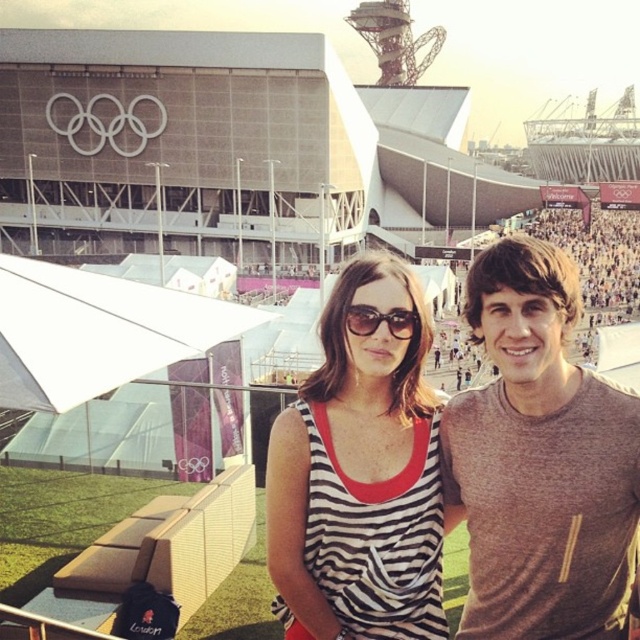
Between striped fabric tank top at center and sunglasses at center, which one appears on the left side from the viewer's perspective?

striped fabric tank top at center

Can you confirm if striped fabric tank top at center is wider than sunglasses at center?

Yes.

Which is behind, point (378, 412) or point (356, 310)?

The point (378, 412) is behind.

This screenshot has height=640, width=640. In order to click on striped fabric tank top at center in this screenshot , I will do `click(358, 476)`.

Who is shorter, gray cotton t-shirt at center or sunglasses at center?

Standing shorter between the two is sunglasses at center.

Who is lower down, gray cotton t-shirt at center or sunglasses at center?

gray cotton t-shirt at center is lower down.

Does point (500, 435) come farther from viewer compared to point (372, 310)?

No, (500, 435) is closer to viewer.

Find the location of `gray cotton t-shirt at center`. gray cotton t-shirt at center is located at coordinates (540, 460).

Who is shorter, gray cotton t-shirt at center or striped fabric tank top at center?

With less height is striped fabric tank top at center.

Who is lower down, gray cotton t-shirt at center or striped fabric tank top at center?

striped fabric tank top at center

Image resolution: width=640 pixels, height=640 pixels. What do you see at coordinates (540, 460) in the screenshot?
I see `gray cotton t-shirt at center` at bounding box center [540, 460].

Where is `gray cotton t-shirt at center`? gray cotton t-shirt at center is located at coordinates (540, 460).